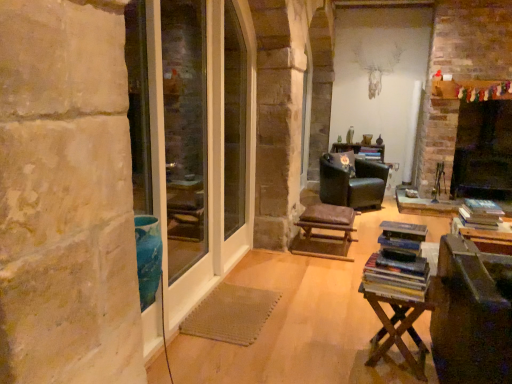
Identify the location of free space between wooden table at lower right and clear glass screen door at left, which is the 2th screen door in left-to-right order. click(x=269, y=319).